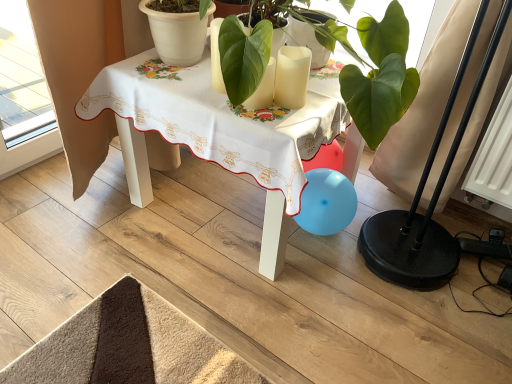
Where is `white fabric table at center`? The width and height of the screenshot is (512, 384). white fabric table at center is located at coordinates (215, 137).

Can you confirm if white fabric table at center is shorter than white matte flowerpot at upper center?

In fact, white fabric table at center may be taller than white matte flowerpot at upper center.

Is white fabric table at center in contact with white matte flowerpot at upper center?

white fabric table at center and white matte flowerpot at upper center are clearly separated.

Can you confirm if white fabric table at center is positioned to the left of white matte flowerpot at upper center?

In fact, white fabric table at center is to the right of white matte flowerpot at upper center.

Is white fabric table at center turned away from white matte flowerpot at upper center?

That's not correct — white fabric table at center is not looking away from white matte flowerpot at upper center.

Who is shorter, white matte candle at center or white matte flowerpot at upper center?

With less height is white matte candle at center.

Locate an element on the screen. Image resolution: width=512 pixels, height=384 pixels. flowerpot that is above the white matte candle at center (from a real-world perspective) is located at coordinates (176, 35).

Is white matte candle at center touching white matte flowerpot at upper center?

No.

The image size is (512, 384). Identify the location of table that appears in front of the white matte candle at center. (215, 137).

Between white matte candle at center and white fabric table at center, which one is positioned in front?

white fabric table at center.

Considering the sizes of objects white matte candle at center and white fabric table at center in the image provided, who is shorter, white matte candle at center or white fabric table at center?

Standing shorter between the two is white matte candle at center.

In terms of size, does white matte candle at center appear bigger or smaller than white fabric table at center?

Clearly, white matte candle at center is smaller in size than white fabric table at center.

I want to click on flowerpot that is above the white fabric table at center (from a real-world perspective), so click(176, 35).

Consider the image. Who is taller, white matte flowerpot at upper center or white fabric table at center?

white fabric table at center.

How distant is white matte flowerpot at upper center from white fabric table at center?

A distance of 9.92 inches exists between white matte flowerpot at upper center and white fabric table at center.

Considering the positions of objects white matte flowerpot at upper center and white fabric table at center in the image provided, who is behind, white matte flowerpot at upper center or white fabric table at center?

white matte flowerpot at upper center is behind.

Between white matte flowerpot at upper center and white matte candle at center, which one has smaller size?

white matte candle at center is smaller.

Which point is more forward, (177, 28) or (289, 94)?

The point (289, 94) is in front.

Considering the sizes of objects white matte flowerpot at upper center and white matte candle at center in the image provided, who is taller, white matte flowerpot at upper center or white matte candle at center?

Standing taller between the two is white matte flowerpot at upper center.

Would you say white fabric table at center contains white matte candle at center?

No.

What's the angular difference between white fabric table at center and white matte candle at center's facing directions?

white fabric table at center and white matte candle at center are facing 6.08 degrees away from each other.

Are white fabric table at center and white matte candle at center beside each other?

No, white fabric table at center is not making contact with white matte candle at center.

Which is less distant, (228, 163) or (288, 58)?

The point (288, 58) is closer to the camera.

I want to click on table in front of the white matte flowerpot at upper center, so click(215, 137).

Where is `flowerpot behind the white matte candle at center`? The image size is (512, 384). flowerpot behind the white matte candle at center is located at coordinates (176, 35).

Considering their positions, is white matte candle at center positioned closer to white matte flowerpot at upper center than white fabric table at center?

white fabric table at center is closer to white matte flowerpot at upper center.

Which object lies further to the anchor point white matte flowerpot at upper center, white fabric table at center or white matte candle at center?

Based on the image, white matte candle at center appears to be further to white matte flowerpot at upper center.

Which object lies further to the anchor point white matte candle at center, white matte flowerpot at upper center or white fabric table at center?

white matte flowerpot at upper center lies further to white matte candle at center than the other object.

When comparing their distances from white fabric table at center, does white matte candle at center or white matte flowerpot at upper center seem closer?

The object closer to white fabric table at center is white matte flowerpot at upper center.

Based on the photo, from the image, which object appears to be farther from white matte candle at center, white fabric table at center or white matte flowerpot at upper center?

Among the two, white matte flowerpot at upper center is located further to white matte candle at center.

Considering their positions, is white matte flowerpot at upper center positioned further to white fabric table at center than white matte candle at center?

Among the two, white matte candle at center is located further to white fabric table at center.

Where is `table situated between white matte flowerpot at upper center and white matte candle at center from left to right`? The width and height of the screenshot is (512, 384). table situated between white matte flowerpot at upper center and white matte candle at center from left to right is located at coordinates (215, 137).